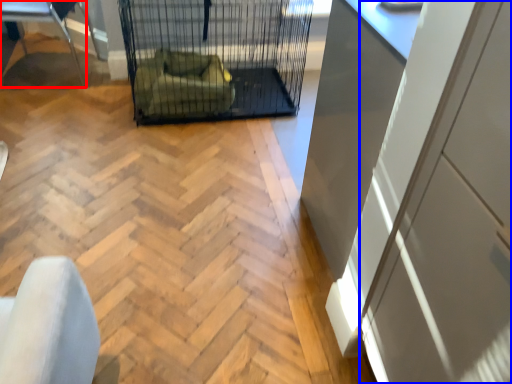
Question: Among these objects, which one is farthest to the camera, furniture (highlighted by a red box) or screen door (highlighted by a blue box)?

Choices:
 (A) furniture
 (B) screen door

Answer: (A)